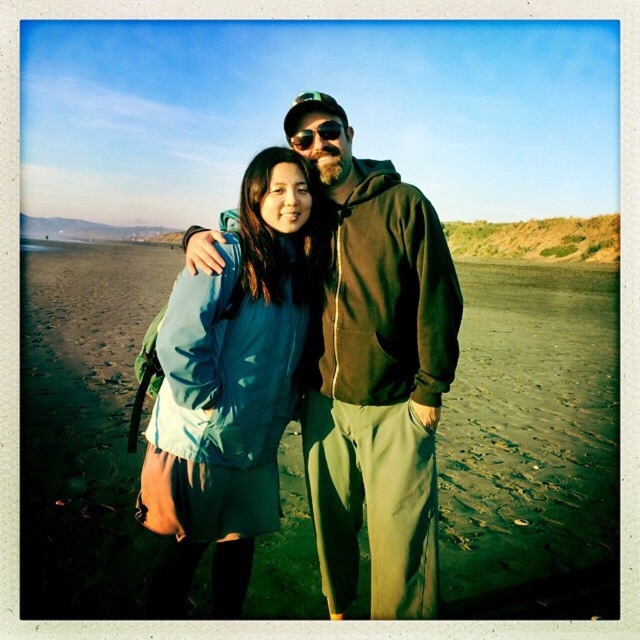
From the picture: You are a photographer standing at the edge of the beach. You want to take a photo of the green matte jacket at center and the sunglasses at center. If your camera has a focal length of 50mm, which object should you focus on to ensure both are in sharp focus given the depth of field?

The green matte jacket at center is 31.67 inches away from sunglasses at center. Since the distance between them is relatively small, focusing on the midpoint between the two objects would ensure both are within the depth of field at a 50mm focal length.

You are a photographer trying to capture a photo of the green sand at center and the sunglasses at center. Which object should you focus on first if you want to ensure both are in focus?

The green sand at center is closer to the viewer than sunglasses at center. To ensure both are in focus, focus on the sunglasses at center since it is farther away, allowing the closer green sand to also be in focus within the depth of field.